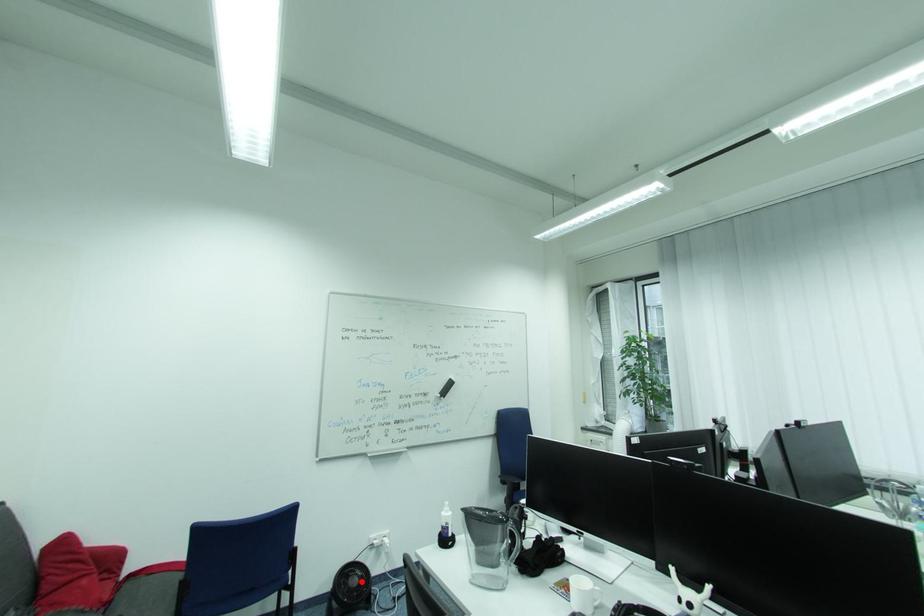
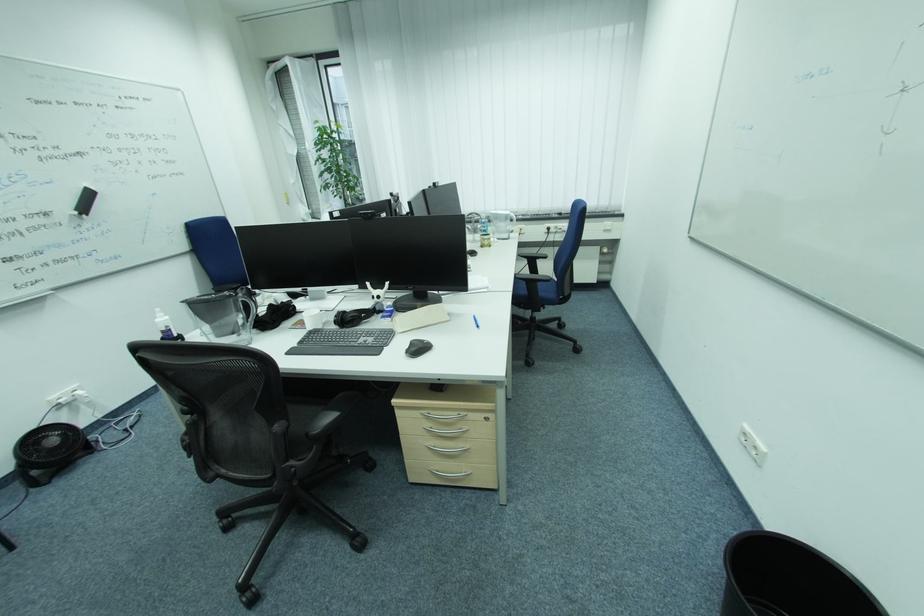
Question: I am providing you with two images of the same scene from different viewpoints. Given a red point in image1, look at the same physical point in image2. Is it:

Choices:
 (A) Closer to the viewpoint
 (B) Farther from the viewpoint

Answer: (B)